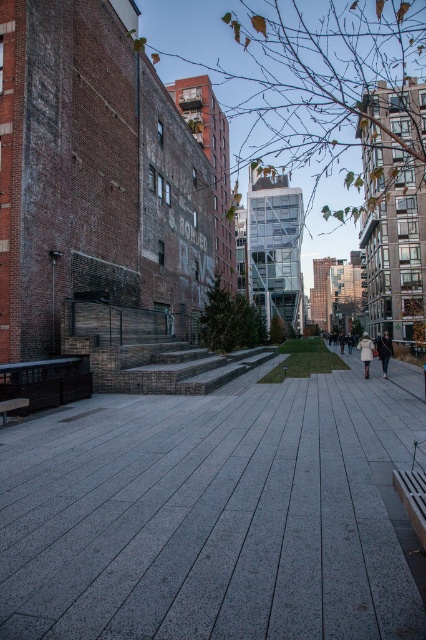
Can you confirm if gray concrete pavement at center is shorter than dark brown leather jacket at center?

Yes, gray concrete pavement at center is shorter than dark brown leather jacket at center.

Who is lower down, gray concrete pavement at center or dark brown leather jacket at center?

gray concrete pavement at center is below.

Does point (386, 484) come behind point (385, 364)?

No.

Locate an element on the screen. gray concrete pavement at center is located at coordinates (213, 515).

Is point (408, 504) more distant than point (367, 352)?

That is False.

Consider the image. Is wooden park bench at lower right to the left of white wool coat at right from the viewer's perspective?

Yes, wooden park bench at lower right is to the left of white wool coat at right.

Between point (416, 493) and point (365, 378), which one is positioned in front?

Point (416, 493) is in front.

This screenshot has height=640, width=426. I want to click on wooden park bench at lower right, so click(x=412, y=497).

Is dark brown leather jacket at center positioned at the back of white wool coat at right?

That is False.

Between dark brown leather jacket at center and white wool coat at right, which one appears on the left side from the viewer's perspective?

dark brown leather jacket at center

Is point (388, 356) positioned before point (367, 368)?

Yes, it is in front of point (367, 368).

Where is `dark brown leather jacket at center`? The height and width of the screenshot is (640, 426). dark brown leather jacket at center is located at coordinates (385, 349).